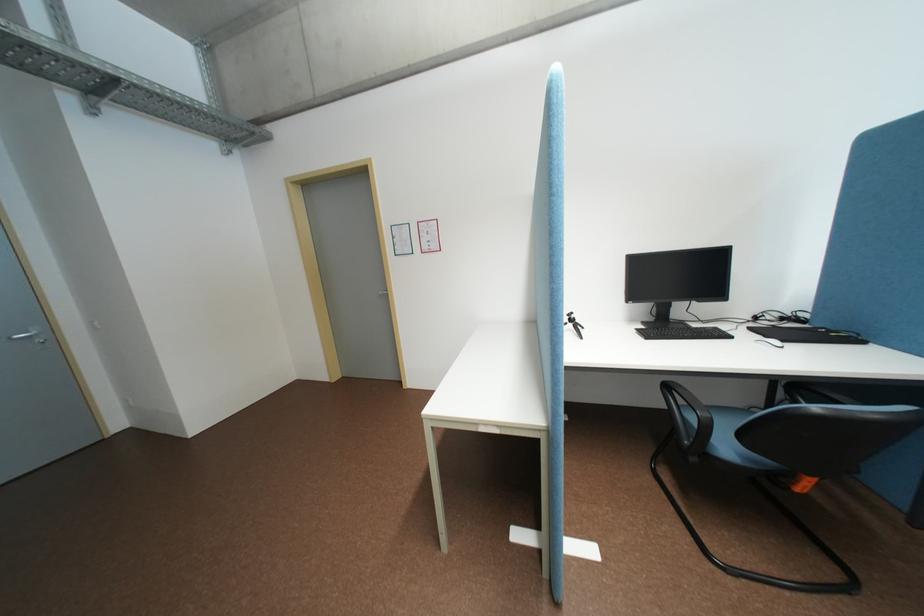
This screenshot has height=616, width=924. In order to click on blue chair sitting surface in this screenshot , I will do `click(775, 427)`.